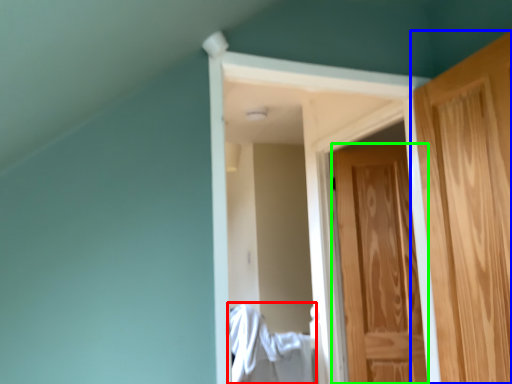
Question: Which object is positioned closest to laundry (highlighted by a red box)? Select from door (highlighted by a blue box) and door (highlighted by a green box).

Choices:
 (A) door
 (B) door

Answer: (B)